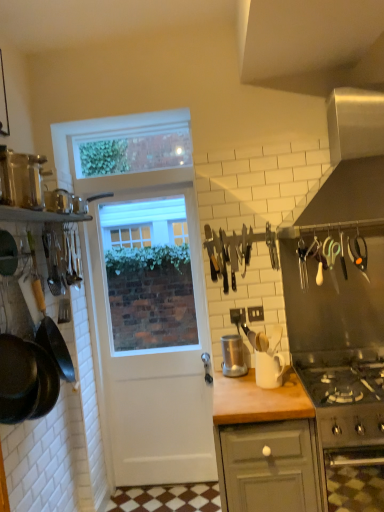
You are a GUI agent. You are given a task and a screenshot of the screen. Output one action in this format:
    pyautogui.click(x=<x>, y=<y>)
    Task: Click on the free point above matte gray cabinet at lower center (from a real-world perspective)
    This screenshot has width=384, height=512.
    Given the screenshot: What is the action you would take?
    pyautogui.click(x=263, y=390)